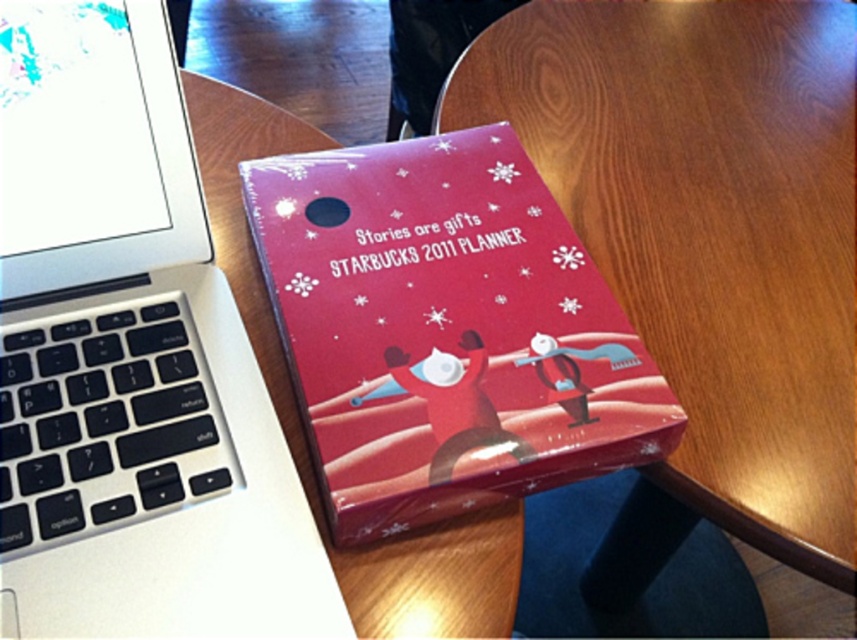
Question: Does sleek silver laptop at upper left have a lesser width compared to wooden at center?

Choices:
 (A) no
 (B) yes

Answer: (B)

Question: Which object is closer to the camera taking this photo?

Choices:
 (A) wooden at center
 (B) matte red planner at center
 (C) sleek silver laptop at upper left

Answer: (C)

Question: Estimate the real-world distances between objects in this image. Which object is farther from the matte red planner at center?

Choices:
 (A) sleek silver laptop at upper left
 (B) wooden at center

Answer: (B)

Question: Estimate the real-world distances between objects in this image. Which object is closer to the matte red planner at center?

Choices:
 (A) wooden at center
 (B) sleek silver laptop at upper left

Answer: (B)

Question: Is sleek silver laptop at upper left wider than matte red planner at center?

Choices:
 (A) no
 (B) yes

Answer: (A)

Question: Is sleek silver laptop at upper left behind matte red planner at center?

Choices:
 (A) no
 (B) yes

Answer: (A)